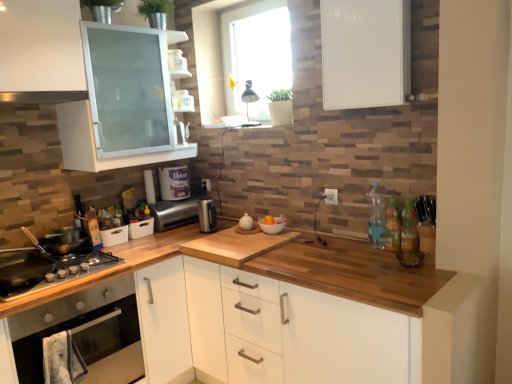
Locate an element on the screen. Image resolution: width=512 pixels, height=384 pixels. vacant area in front of clear plastic bottle at right, placed as the first bottle when sorted from left to right is located at coordinates pyautogui.click(x=380, y=259).